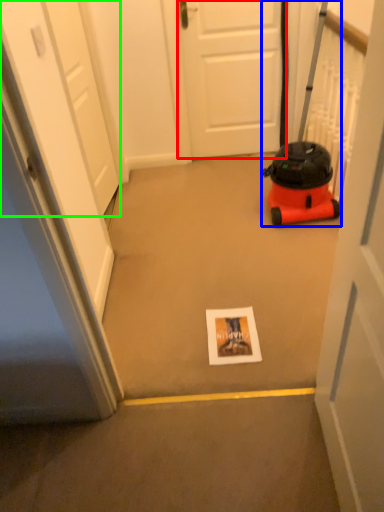
Question: Based on their relative distances, which object is farther from door (highlighted by a red box)? Choose from equipment (highlighted by a blue box) and door (highlighted by a green box).

Choices:
 (A) equipment
 (B) door

Answer: (B)